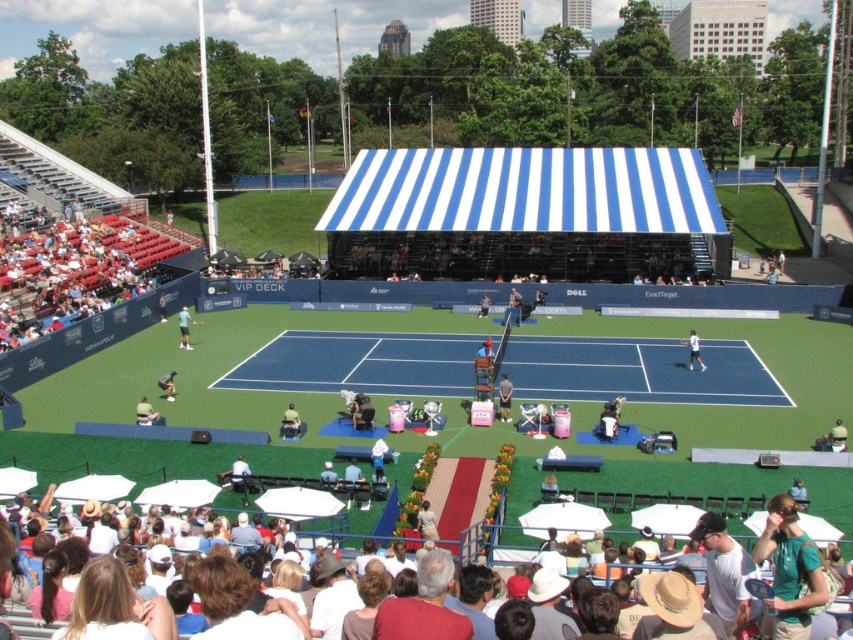
You are a photographer trying to capture a wide shot of the tennis court. You notice the green fabric umbrella at lower right and the white tennis racket at center. Which object is narrower in width?

The green fabric umbrella at lower right is narrower in width than the white tennis racket at center.